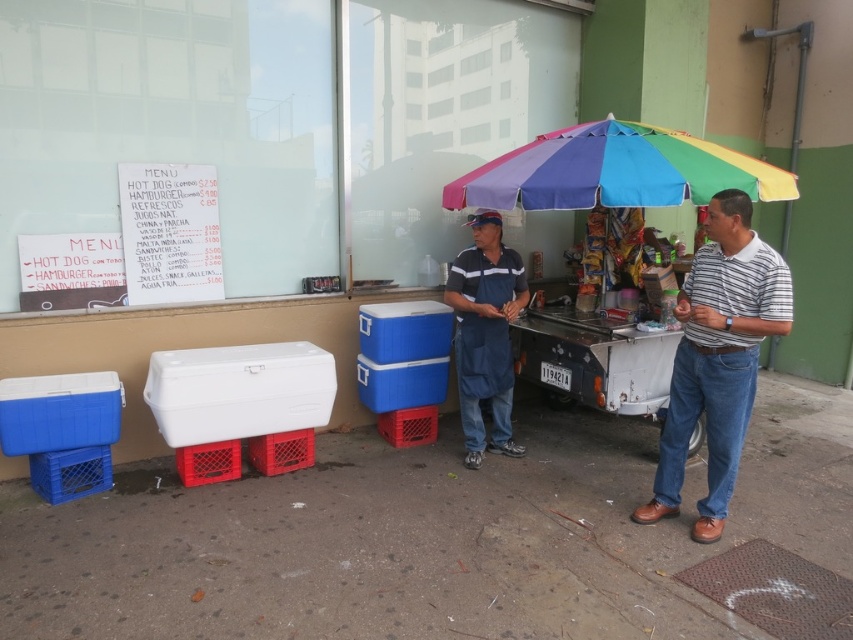
Question: From the image, what is the correct spatial relationship of rainbow fabric umbrella at upper right in relation to blue fabric shirt at center?

Choices:
 (A) left
 (B) right

Answer: (B)

Question: Which point is farther from the camera taking this photo?

Choices:
 (A) (691, 316)
 (B) (688, 188)

Answer: (B)

Question: Can you confirm if striped cotton polo shirt at right is positioned below rainbow fabric umbrella at upper right?

Choices:
 (A) no
 (B) yes

Answer: (B)

Question: Which object is farther from the camera taking this photo?

Choices:
 (A) rainbow fabric umbrella at upper right
 (B) striped cotton polo shirt at right

Answer: (A)

Question: Can you confirm if striped cotton polo shirt at right is positioned above rainbow fabric umbrella at upper right?

Choices:
 (A) yes
 (B) no

Answer: (B)

Question: Which point is closer to the camera?

Choices:
 (A) (517, 312)
 (B) (682, 436)

Answer: (B)